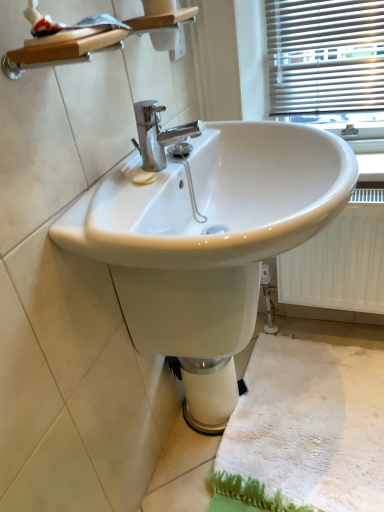
Question: Is white glossy sink at center taller than white fluffy bath mat at lower right?

Choices:
 (A) yes
 (B) no

Answer: (A)

Question: Would you say white fluffy bath mat at lower right is part of white glossy sink at center's contents?

Choices:
 (A) no
 (B) yes

Answer: (A)

Question: Is white glossy sink at center facing away from white fluffy bath mat at lower right?

Choices:
 (A) no
 (B) yes

Answer: (A)

Question: From the image's perspective, is white glossy sink at center on white fluffy bath mat at lower right?

Choices:
 (A) yes
 (B) no

Answer: (A)

Question: Considering the relative sizes of white glossy sink at center and white fluffy bath mat at lower right in the image provided, is white glossy sink at center smaller than white fluffy bath mat at lower right?

Choices:
 (A) yes
 (B) no

Answer: (B)

Question: From the image's perspective, relative to white fluffy bath mat at lower right, is white glossy sink at center above or below?

Choices:
 (A) below
 (B) above

Answer: (B)

Question: Is white glossy sink at center in front of or behind white fluffy bath mat at lower right in the image?

Choices:
 (A) front
 (B) behind

Answer: (A)

Question: From a real-world perspective, relative to white fluffy bath mat at lower right, is white glossy sink at center vertically above or below?

Choices:
 (A) above
 (B) below

Answer: (A)

Question: Considering the positions of white glossy sink at center and white fluffy bath mat at lower right in the image, is white glossy sink at center bigger or smaller than white fluffy bath mat at lower right?

Choices:
 (A) big
 (B) small

Answer: (A)

Question: Is white textured radiator at lower right inside or outside of white glossy sink at center?

Choices:
 (A) inside
 (B) outside

Answer: (B)

Question: From the image's perspective, relative to white glossy sink at center, is white textured radiator at lower right above or below?

Choices:
 (A) above
 (B) below

Answer: (B)

Question: Is point (324, 261) positioned closer to the camera than point (162, 289)?

Choices:
 (A) closer
 (B) farther

Answer: (B)

Question: In terms of width, does white textured radiator at lower right look wider or thinner when compared to white glossy sink at center?

Choices:
 (A) wide
 (B) thin

Answer: (B)

Question: Considering their positions, is white glossy sink at center located in front of or behind white textured radiator at lower right?

Choices:
 (A) behind
 (B) front

Answer: (B)

Question: In terms of size, does white glossy sink at center appear bigger or smaller than white textured radiator at lower right?

Choices:
 (A) small
 (B) big

Answer: (B)